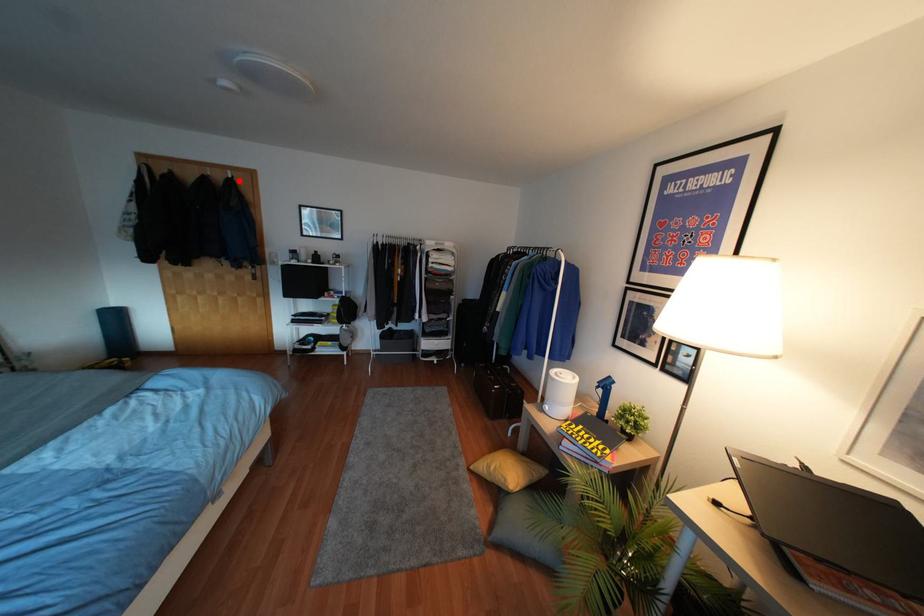
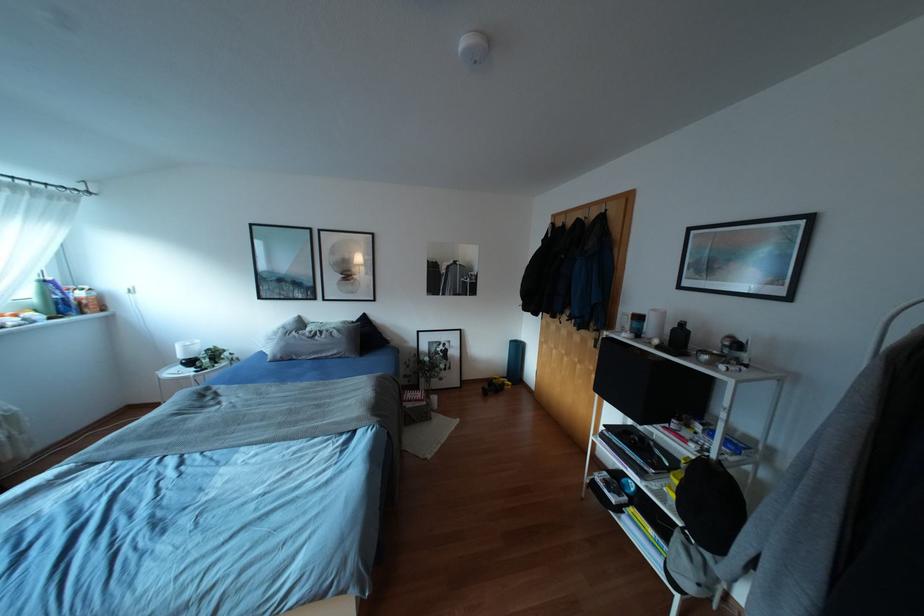
In the second image, find the point that corresponds to the highlighted location in the first image.

(612, 214)